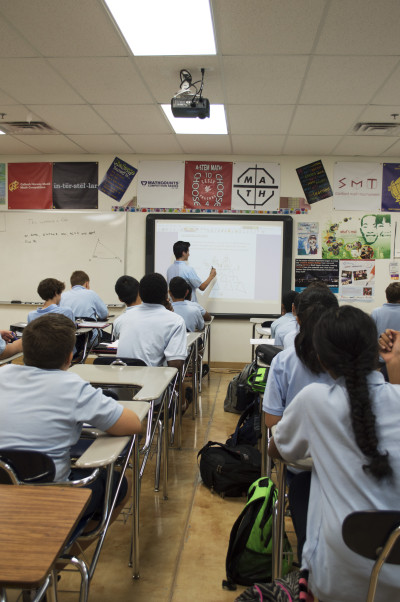
At what (x,y) coordinates should I click in order to perform the action: click on desks. Please return your answer as a coordinate pair (x, y). The height and width of the screenshot is (602, 400). Looking at the image, I should click on (106, 371), (104, 448), (41, 512), (94, 324), (256, 315), (260, 336).